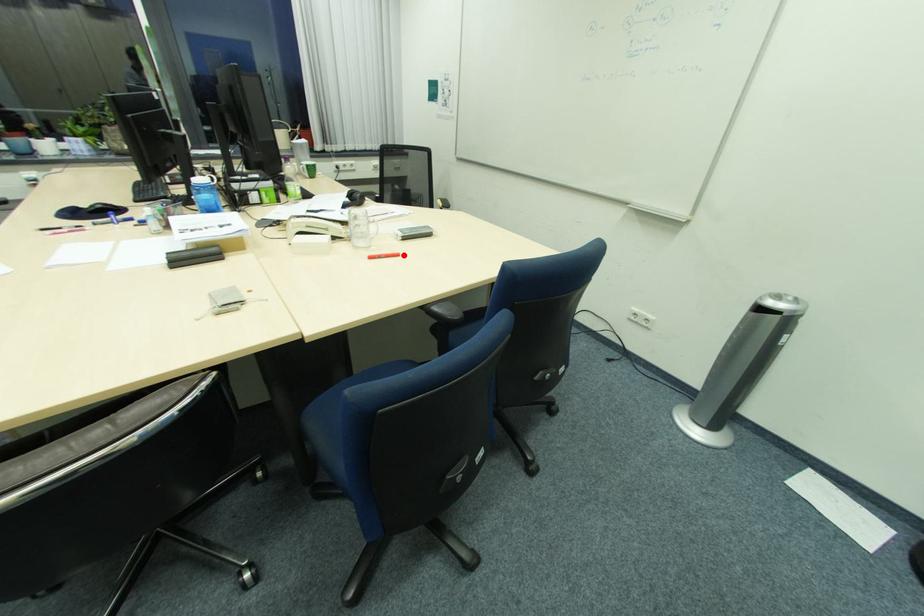
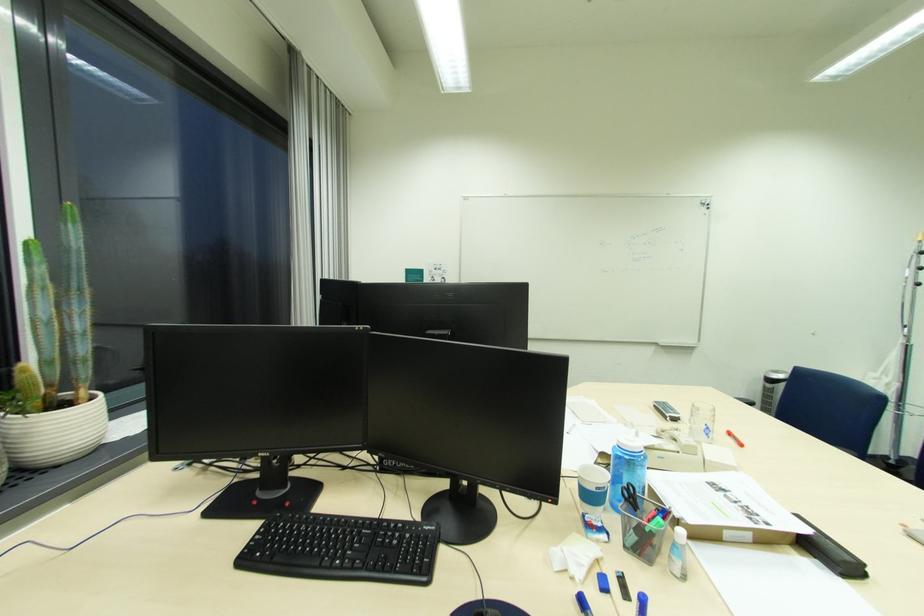
Question: I am providing you with two images of the same scene from different viewpoints. A red point is marked on the first image. Can you still see the location of the red point in image 2?

Choices:
 (A) Yes
 (B) No

Answer: (A)